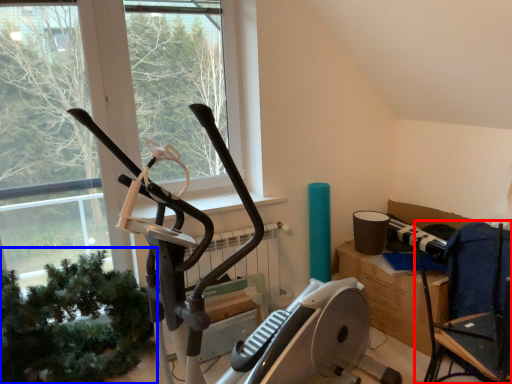
Question: Which of the following is the farthest to the observer, chair (highlighted by a red box) or plant (highlighted by a blue box)?

Choices:
 (A) chair
 (B) plant

Answer: (B)